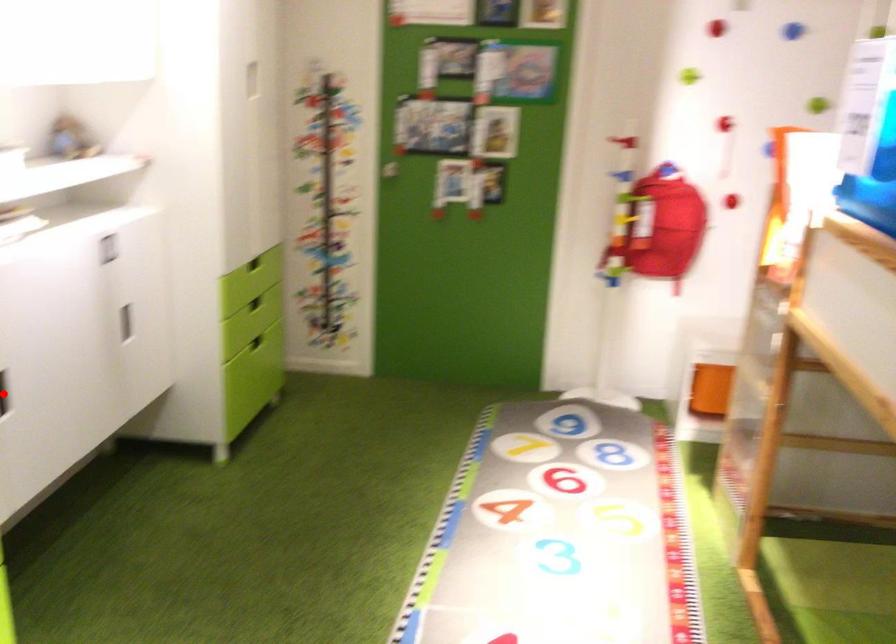
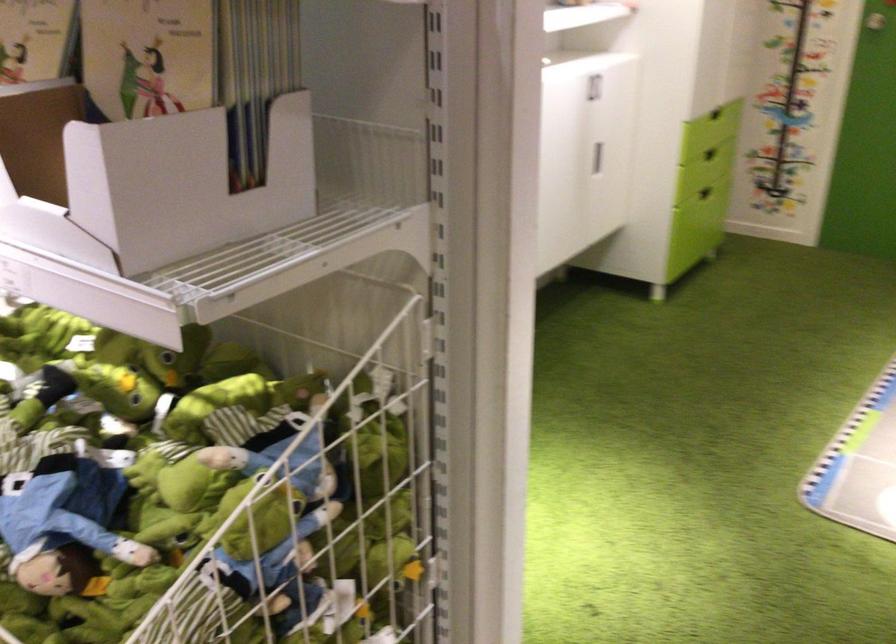
Question: I am providing you with two images of the same scene from different viewpoints. A red point is marked on the first image. Is the red point's position out of view in image 2?

Choices:
 (A) Yes
 (B) No

Answer: (A)